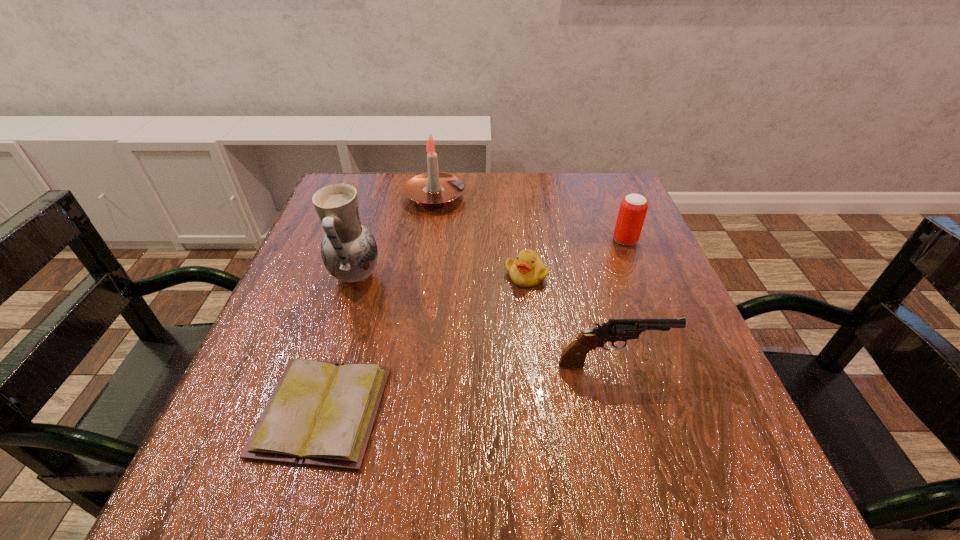
This screenshot has width=960, height=540. Find the location of `free point between the pottery and the duckling`. free point between the pottery and the duckling is located at coordinates (441, 275).

Identify the location of vacant space that is in between the pottery and the gun. The width and height of the screenshot is (960, 540). (484, 320).

The image size is (960, 540). What are the coordinates of `vacant region between the diary and the gun` in the screenshot? It's located at (468, 387).

Where is `vacant region between the pottery and the second shortest object`? The width and height of the screenshot is (960, 540). vacant region between the pottery and the second shortest object is located at coordinates (441, 275).

At what (x,y) coordinates should I click in order to perform the action: click on vacant space that is in between the gun and the pottery. Please return your answer as a coordinate pair (x, y). This screenshot has width=960, height=540. Looking at the image, I should click on (484, 320).

The width and height of the screenshot is (960, 540). In order to click on free area in between the diary and the beer can in this screenshot , I will do (x=474, y=326).

Identify the location of object identified as the fourth closest to the pottery. Image resolution: width=960 pixels, height=540 pixels. (573, 356).

Find the location of a particular element. The height and width of the screenshot is (540, 960). object that is the second nearest to the second farthest object is located at coordinates [x=573, y=356].

You are a GUI agent. You are given a task and a screenshot of the screen. Output one action in this format:
    pyautogui.click(x=<x>, y=<y>)
    Task: Click on the free point that satisfies the following two spatial constraints: 1. on the front-facing side of the fifth tallest object; 2. on either side of the pottery
    This screenshot has height=540, width=960.
    Given the screenshot: What is the action you would take?
    pyautogui.click(x=526, y=276)